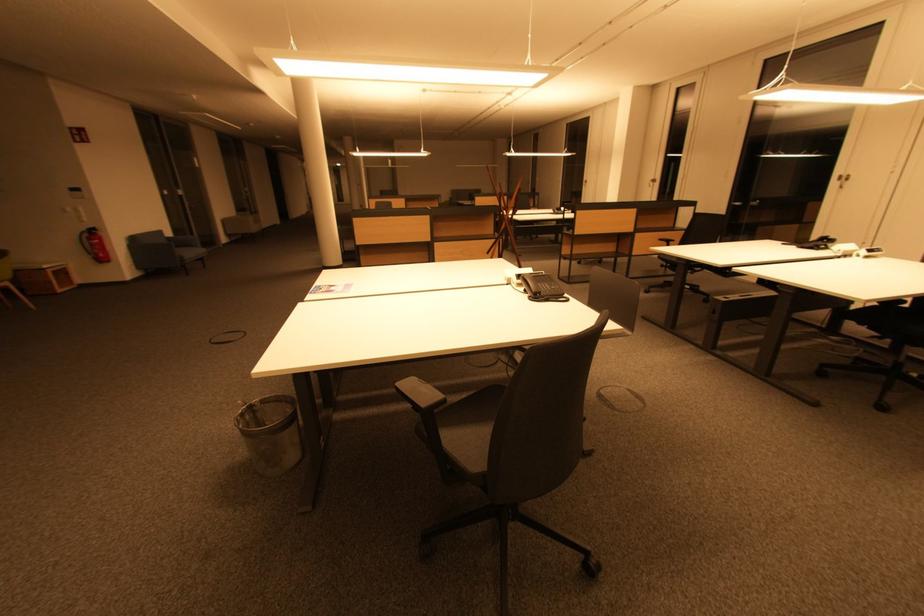
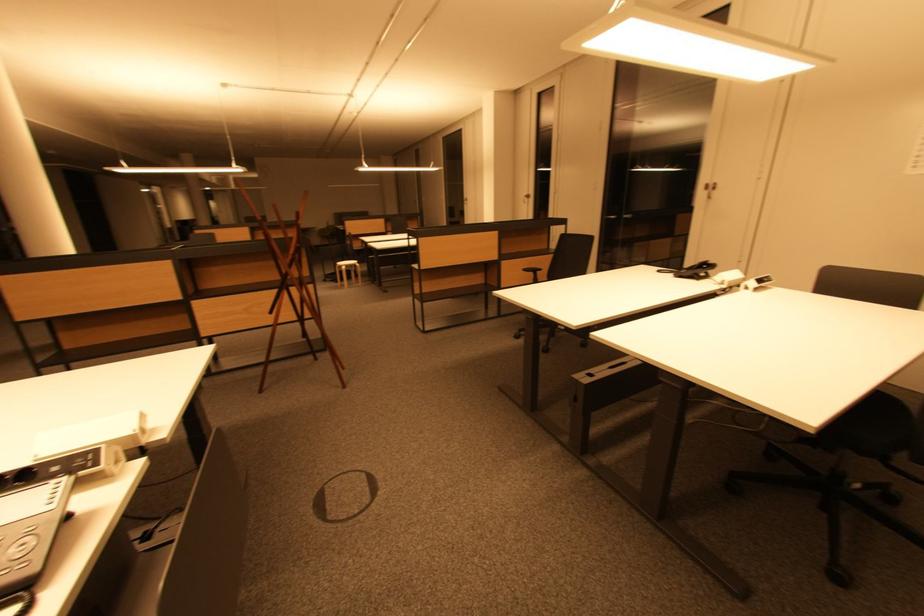
In a continuous first-person perspective shot, in which direction is the camera moving?

The cameraman moved toward right, forward.